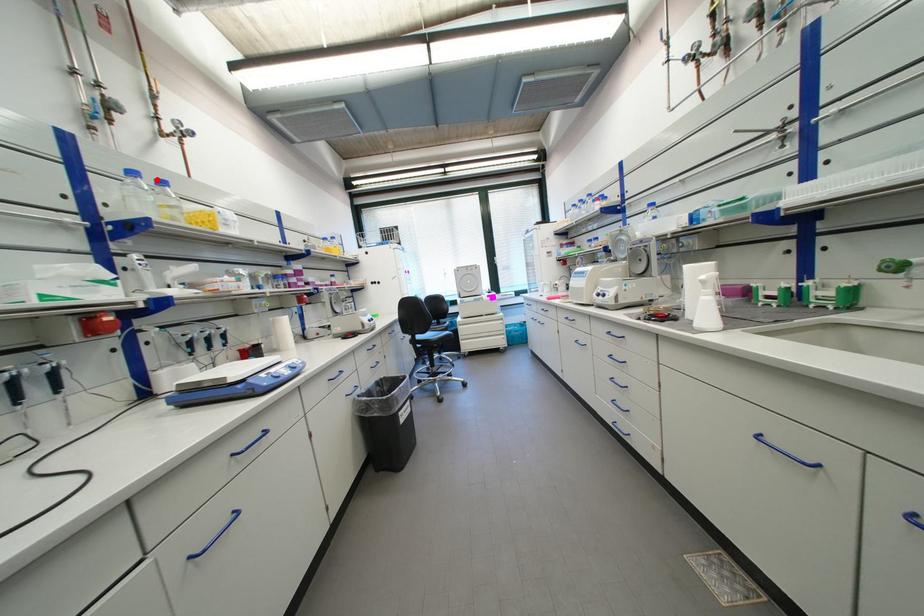
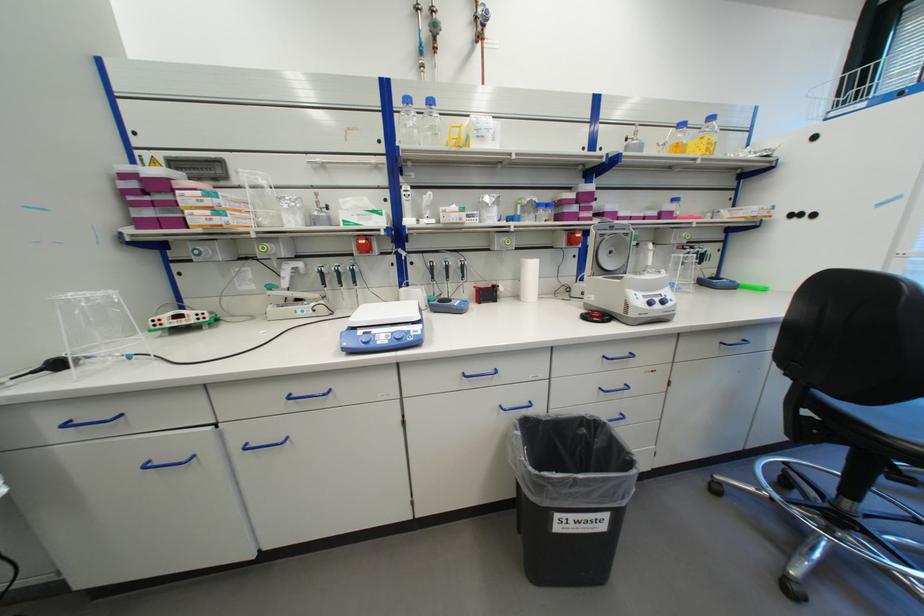
Find the pixel in the second image that matches the highlighted location in the first image.

(428, 103)